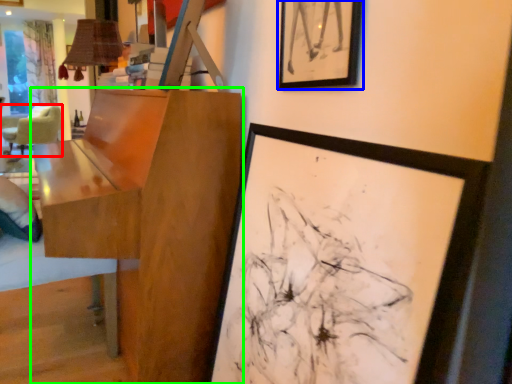
Question: Which object is positioned farthest from chair (highlighted by a red box)? Select from picture frame (highlighted by a blue box) and table (highlighted by a green box).

Choices:
 (A) picture frame
 (B) table

Answer: (A)